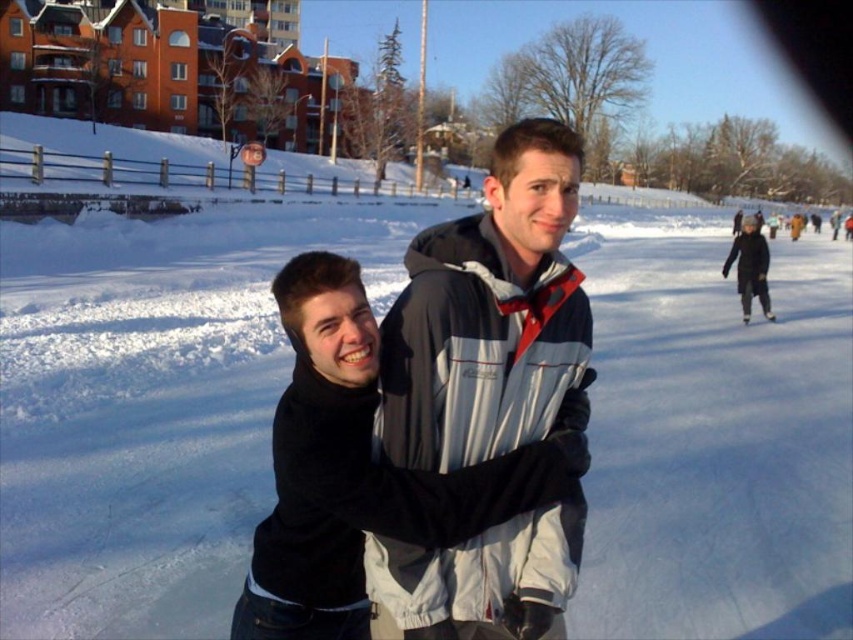
What do you see at coordinates (489, 314) in the screenshot? I see `gray/white jacket at center` at bounding box center [489, 314].

Does gray/white jacket at center have a smaller size compared to black woolen jacket at upper right?

Indeed, gray/white jacket at center has a smaller size compared to black woolen jacket at upper right.

Identify the location of gray/white jacket at center. The height and width of the screenshot is (640, 853). (489, 314).